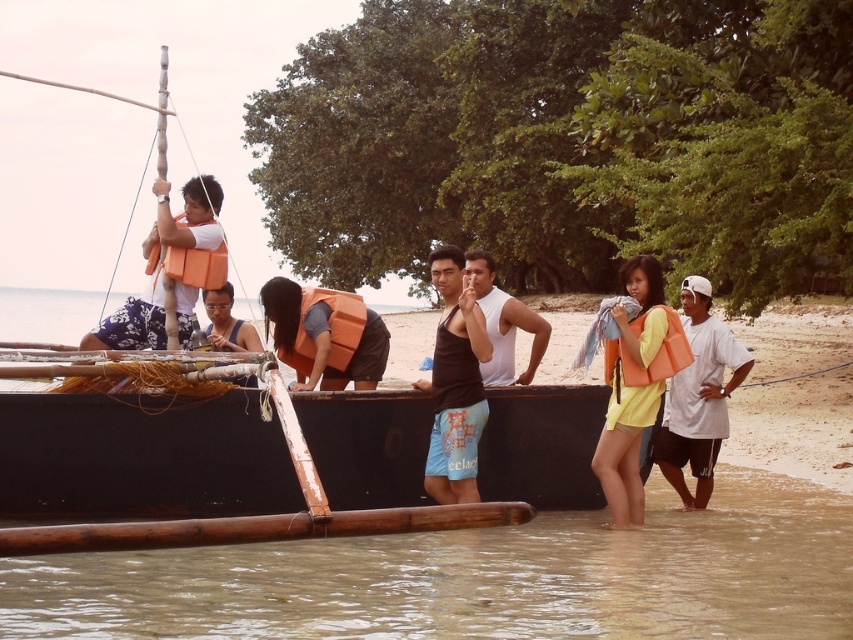
Question: Can you confirm if black tank top at center is thinner than matte orange life vest at center?

Choices:
 (A) no
 (B) yes

Answer: (B)

Question: Is black rubber boat at center positioned in front of matte orange life vest at center?

Choices:
 (A) no
 (B) yes

Answer: (B)

Question: Among these points, which one is nearest to the camera?

Choices:
 (A) (335, 323)
 (B) (241, 328)
 (C) (498, 560)

Answer: (C)

Question: Where is brown muddy water at lower left located in relation to orange foam life jacket at upper left in the image?

Choices:
 (A) right
 (B) left

Answer: (A)

Question: Which of these objects is positioned farthest from the matte orange life vest at right?

Choices:
 (A) orange foam life jacket at right
 (B) black tank top at center

Answer: (B)

Question: Which point is farther from the camera taking this photo?

Choices:
 (A) (445, 296)
 (B) (675, 321)

Answer: (B)